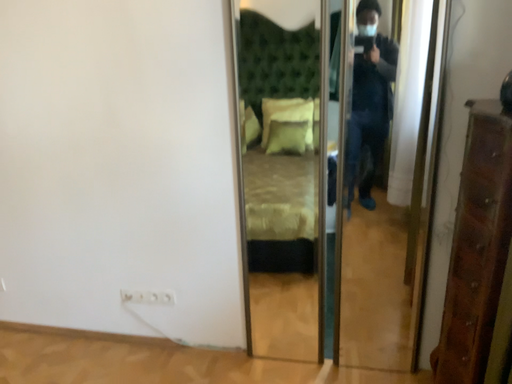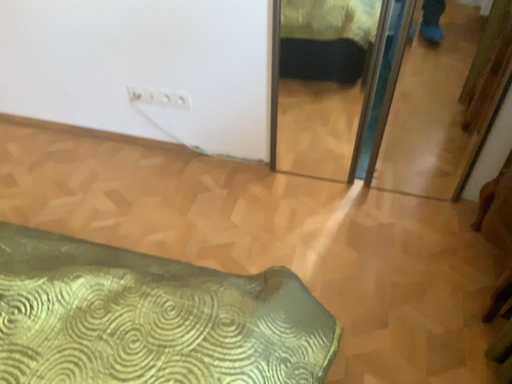
Question: How did the camera likely rotate when shooting the video?

Choices:
 (A) rotated upward
 (B) rotated downward

Answer: (B)